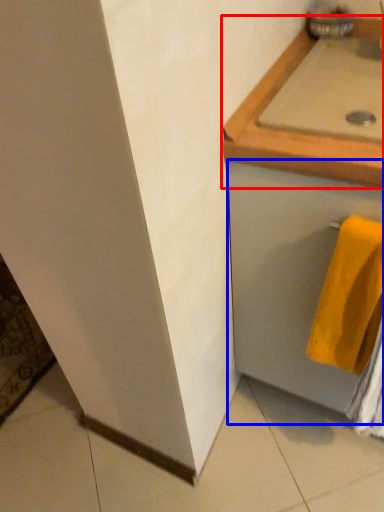
Question: Which object is closer to the camera taking this photo, countertop (highlighted by a red box) or drawer (highlighted by a blue box)?

Choices:
 (A) countertop
 (B) drawer

Answer: (B)